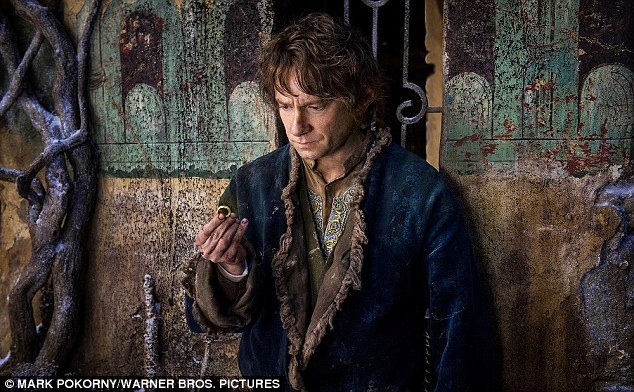
Where is `bar`? The height and width of the screenshot is (392, 634). bar is located at coordinates (404, 54), (378, 27).